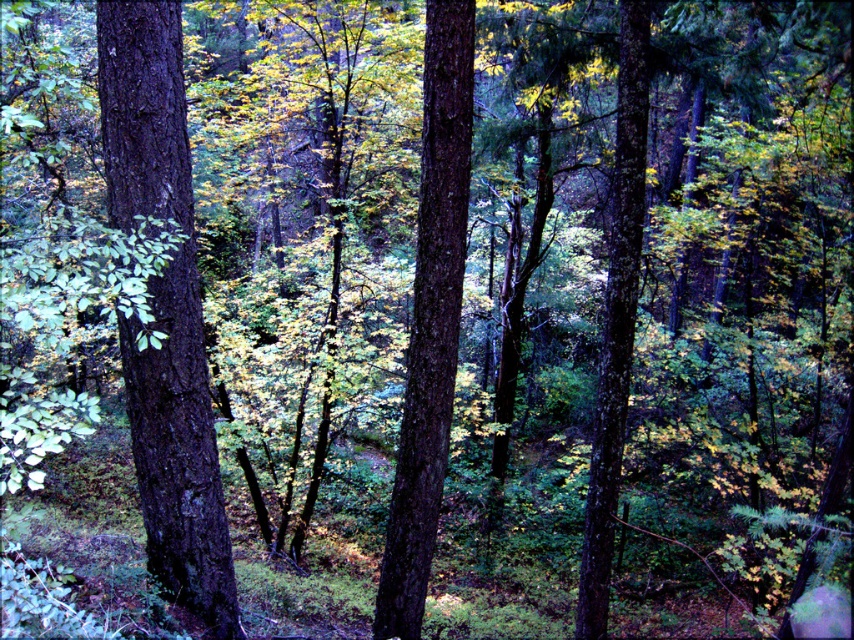
Is smooth dark brown tree trunk at left shorter than smooth bark tree at center?

Yes.

Between smooth dark brown tree trunk at left and smooth bark tree at center, which one appears on the right side from the viewer's perspective?

Positioned to the right is smooth bark tree at center.

The image size is (854, 640). I want to click on smooth dark brown tree trunk at left, so coord(164,312).